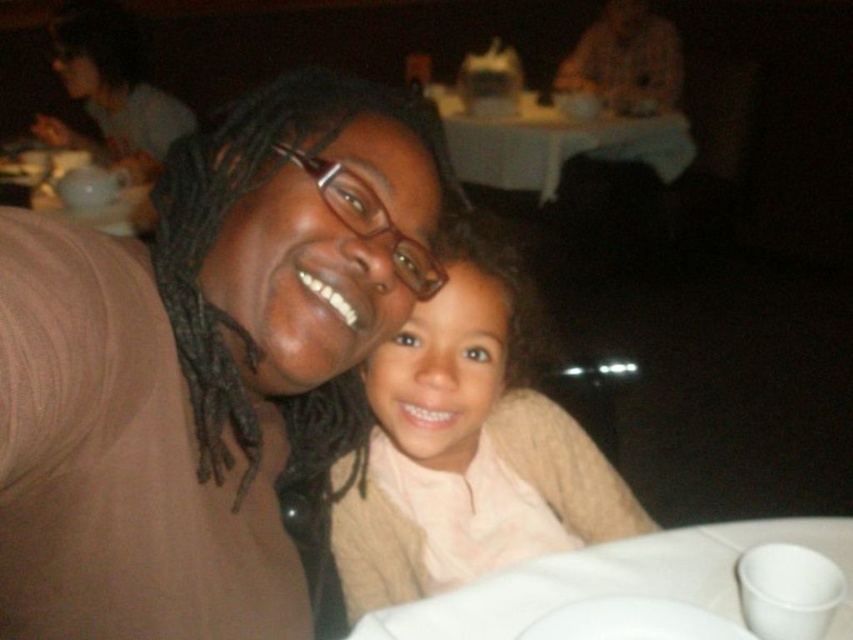
You are an interior designer working on a project and need to place a decorative item exactly at the center of the table. The table has a white tablecloth and there is a smooth beige sweater at center. Where should you place the decorative item?

The smooth beige sweater at center is located at point (467, 449), so you should place the decorative item at that coordinate to center it on the table.

You are a waiter in a restaurant and need to place a new plate on the table. The table has a white cloth table at upper center and a white matte plate at lower center. Where should you place the new plate to avoid covering the existing items?

You should place the new plate on the white cloth table at upper center since it is positioned over the white matte plate at lower center, meaning the plate is already beneath the table.

You are a fashion designer observing two sweaters at a restaurant table. You see the matte brown sweater at center and the smooth beige sweater at center. Which one is positioned to the left?

The matte brown sweater at center is positioned to the left of the smooth beige sweater at center.